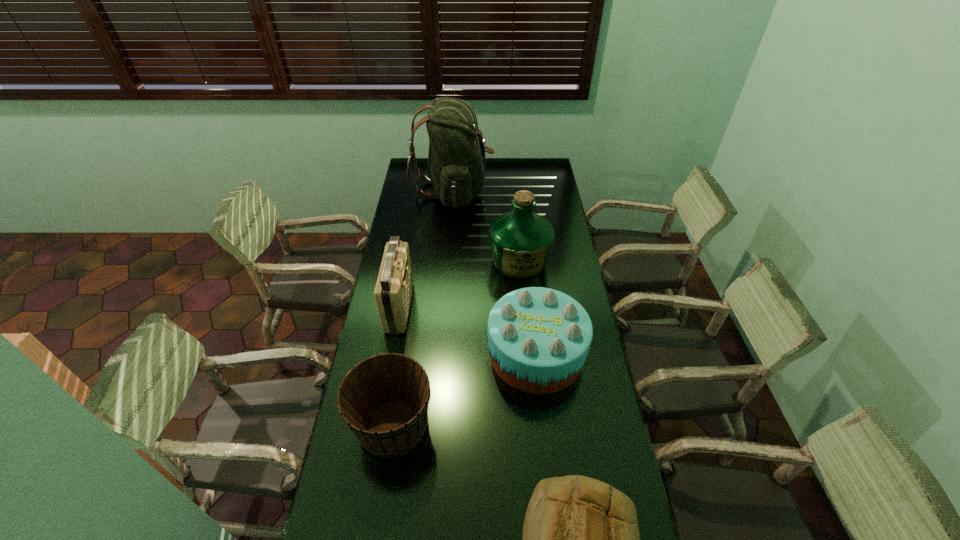
The height and width of the screenshot is (540, 960). What are the coordinates of `free space located on the right of the wine bucket` in the screenshot? It's located at (461, 426).

Identify the location of object present at the far edge. This screenshot has width=960, height=540. (456, 160).

You are a GUI agent. You are given a task and a screenshot of the screen. Output one action in this format:
    pyautogui.click(x=<x>, y=<y>)
    Task: Click on the backpack at the left edge
    The width and height of the screenshot is (960, 540).
    Given the screenshot: What is the action you would take?
    pyautogui.click(x=456, y=160)

Where is `radio receiver present at the left edge`? This screenshot has width=960, height=540. radio receiver present at the left edge is located at coordinates (393, 291).

Locate an element on the screen. Image resolution: width=960 pixels, height=540 pixels. wine bucket at the left edge is located at coordinates (384, 400).

Where is `liquor that is at the right edge`? The width and height of the screenshot is (960, 540). liquor that is at the right edge is located at coordinates (521, 240).

Where is `cake that is positioned at the right edge`? The width and height of the screenshot is (960, 540). cake that is positioned at the right edge is located at coordinates (538, 338).

Where is `object present at the far left corner`? The image size is (960, 540). object present at the far left corner is located at coordinates (456, 160).

Where is `vacant space at the far edge of the desktop`? vacant space at the far edge of the desktop is located at coordinates (521, 166).

In order to click on vacant space at the left edge in this screenshot , I will do `click(418, 182)`.